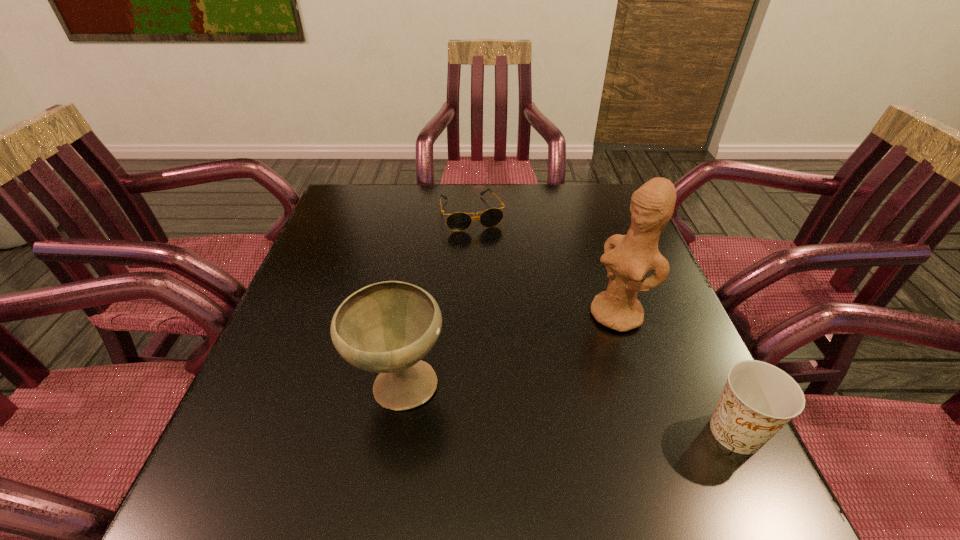
Locate an element on the screen. The image size is (960, 540). blank region between the third shortest object and the second shortest object is located at coordinates (567, 409).

Identify the location of vacant area that lies between the chalice and the shortest object. The image size is (960, 540). (436, 299).

The image size is (960, 540). In order to click on free space between the figurine and the sunglasses in this screenshot , I will do tap(543, 264).

The height and width of the screenshot is (540, 960). In order to click on free space between the chalice and the rightmost object in this screenshot , I will do `click(567, 409)`.

Where is `empty space between the sunglasses and the figurine`? The width and height of the screenshot is (960, 540). empty space between the sunglasses and the figurine is located at coordinates (543, 264).

Locate an element on the screen. Image resolution: width=960 pixels, height=540 pixels. object that is the third closest one to the chalice is located at coordinates (759, 399).

Choose which object is the second nearest neighbor to the third object from left to right. Please provide its 2D coordinates. Your answer should be formatted as a tuple, i.e. [(x, y)], where the tuple contains the x and y coordinates of a point satisfying the conditions above.

[(388, 327)]

Where is `vacant area in the image that satisfies the following two spatial constraints: 1. on the front side of the Dixie cup; 2. on the left side of the chalice`? vacant area in the image that satisfies the following two spatial constraints: 1. on the front side of the Dixie cup; 2. on the left side of the chalice is located at coordinates (392, 432).